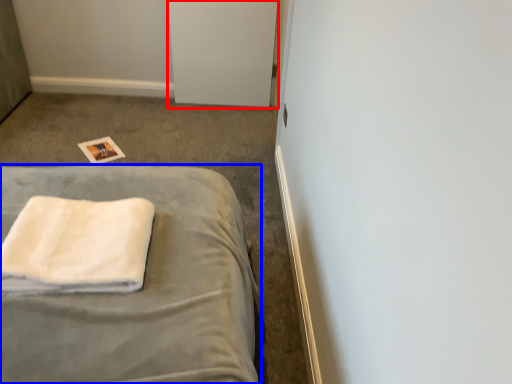
Question: Which object appears farthest to the camera in this image, file cabinet (highlighted by a red box) or bed (highlighted by a blue box)?

Choices:
 (A) file cabinet
 (B) bed

Answer: (A)